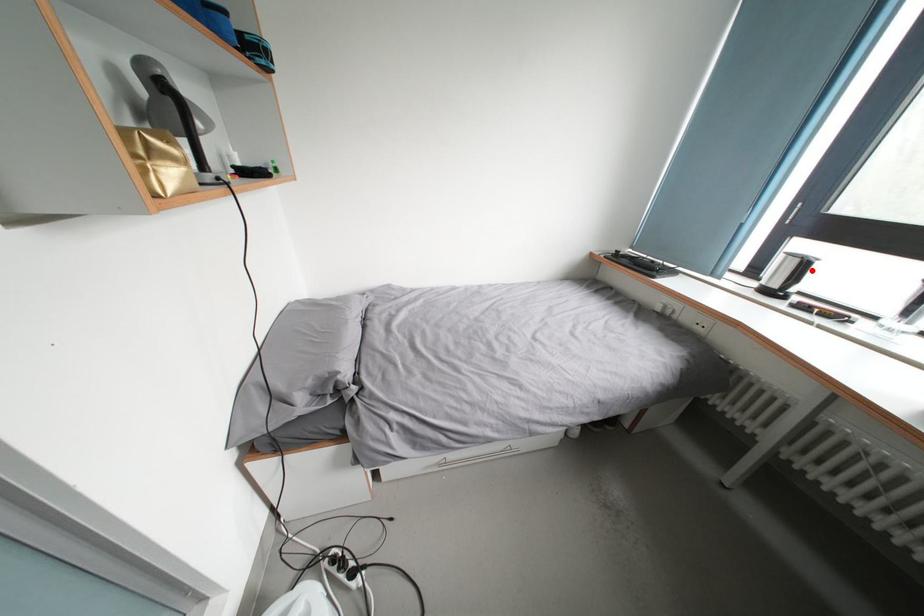
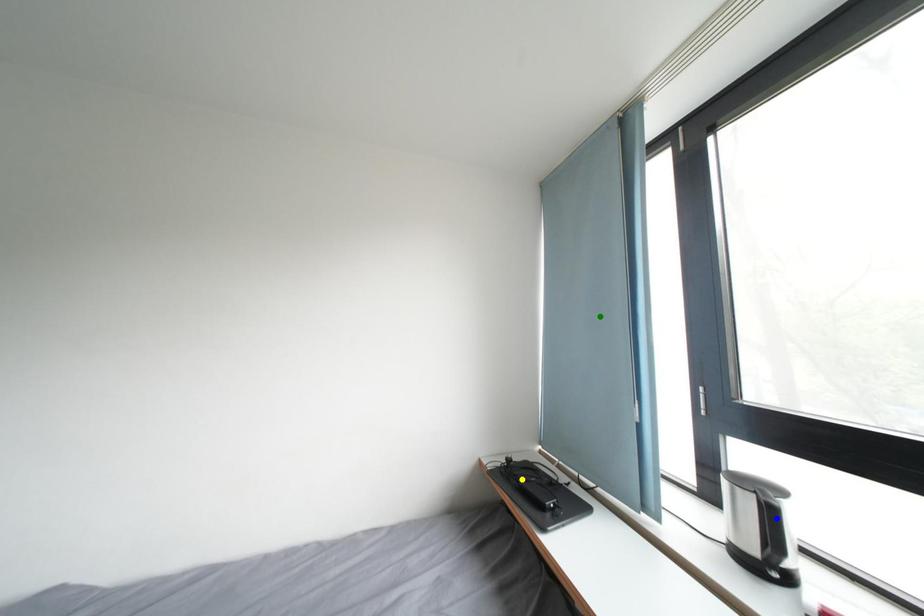
Question: I am providing you with two images of the same scene from different viewpoints. A red point is marked on the first image. You are given multiple points on the second image. Which mark in image 2 goes with the point in image 1?

Choices:
 (A) yellow point
 (B) green point
 (C) blue point

Answer: (C)